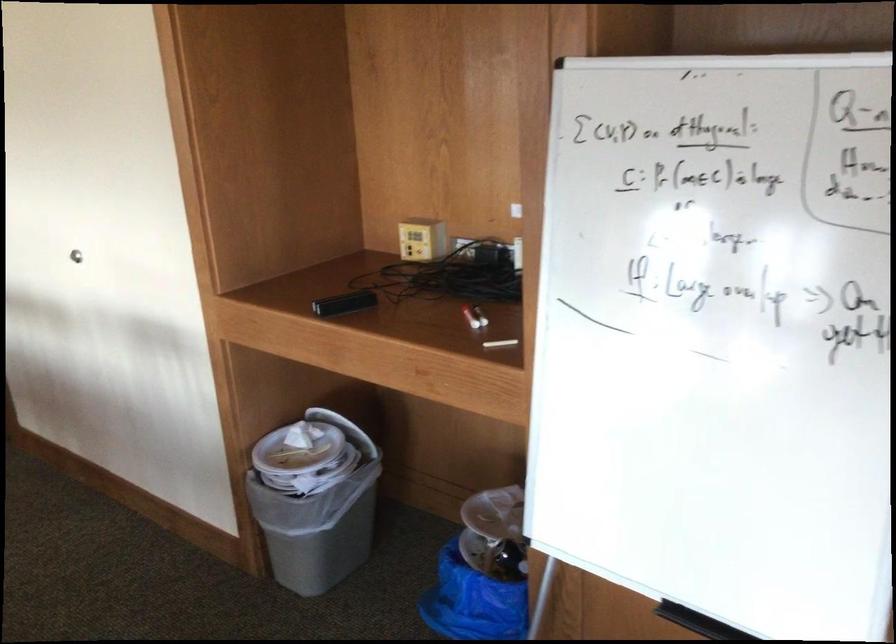
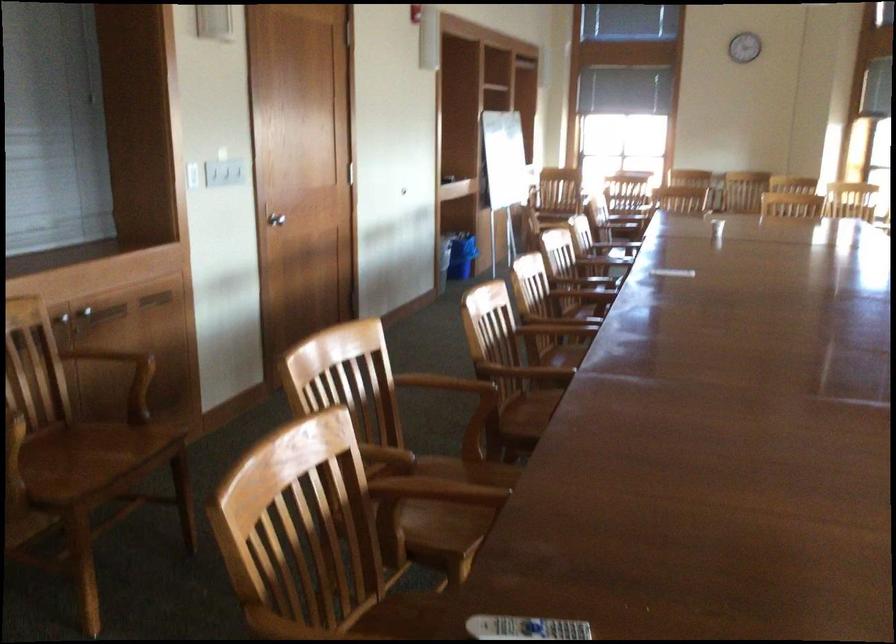
Question: I am providing you with two images of the same scene from different viewpoints. After the viewpoint changes to image2, which objects are now occluded?

Choices:
 (A) cabinet door frame
 (B) silver door handle
 (C) blue trash can
 (D) white paper plate

Answer: (D)